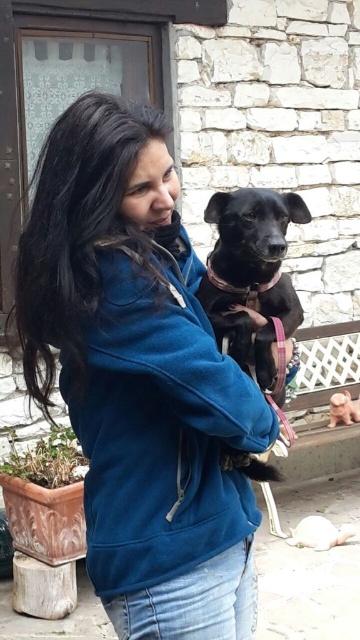
Find the location of a particular element. blue fleece jacket at center is located at coordinates (140, 378).

Can you confirm if blue fleece jacket at center is positioned above black matte dog at center?

Actually, blue fleece jacket at center is below black matte dog at center.

This screenshot has height=640, width=360. Describe the element at coordinates (140, 378) in the screenshot. I see `blue fleece jacket at center` at that location.

Find the location of a particular element. This screenshot has height=640, width=360. blue fleece jacket at center is located at coordinates (140, 378).